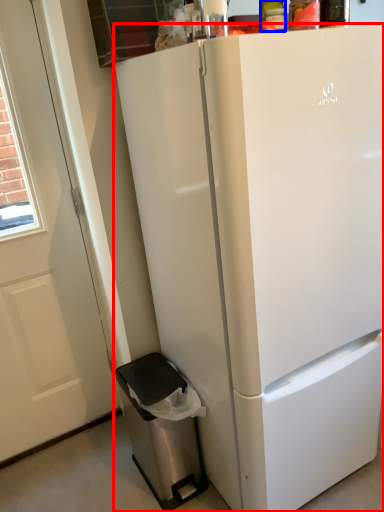
Question: Which point is closer to the camera, refrigerator (highlighted by a red box) or bottle (highlighted by a blue box)?

Choices:
 (A) refrigerator
 (B) bottle

Answer: (A)